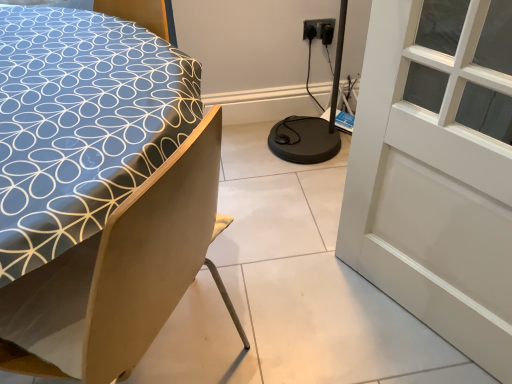
Question: Choose the correct answer: Is blue fabric bed at left inside white glass window at upper right or outside it?

Choices:
 (A) outside
 (B) inside

Answer: (A)

Question: Considering their positions, is blue fabric bed at left located in front of or behind white glass window at upper right?

Choices:
 (A) front
 (B) behind

Answer: (A)

Question: Which is farther from the blue fabric bed at left?

Choices:
 (A) white glass window at upper right
 (B) black plastic electric outlet at upper right

Answer: (B)

Question: Which is farther from the blue fabric bed at left?

Choices:
 (A) white glass window at upper right
 (B) black plastic electric outlet at upper right

Answer: (B)